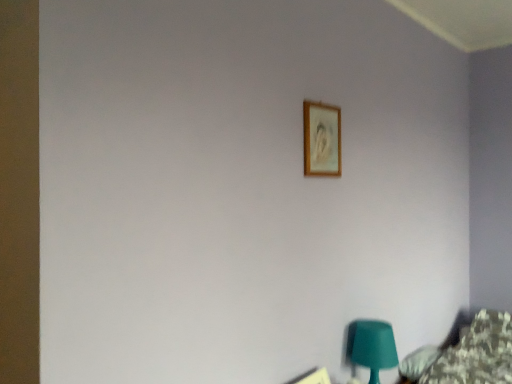
Question: Which direction should I rotate to look at wooden picture frame at upper center, which is the 1th picture frame in bottom-to-top order?

Choices:
 (A) left
 (B) right

Answer: (B)

Question: From a real-world perspective, is wooden picture frame at upper center, which is the 1th picture frame in bottom-to-top order, physically above wooden frame at upper center, the 1th picture frame positioned from the top?

Choices:
 (A) no
 (B) yes

Answer: (A)

Question: Does wooden picture frame at upper center, arranged as the 2th picture frame when viewed from the top, have a lesser height compared to wooden frame at upper center, the second picture frame in the bottom-to-top sequence?

Choices:
 (A) yes
 (B) no

Answer: (A)

Question: Can you confirm if wooden picture frame at upper center, which is the 1th picture frame in bottom-to-top order, is smaller than wooden frame at upper center, the second picture frame in the bottom-to-top sequence?

Choices:
 (A) no
 (B) yes

Answer: (A)

Question: Considering the relative sizes of wooden picture frame at upper center, which is the 1th picture frame in bottom-to-top order, and wooden frame at upper center, the second picture frame in the bottom-to-top sequence, in the image provided, is wooden picture frame at upper center, which is the 1th picture frame in bottom-to-top order, wider than wooden frame at upper center, the second picture frame in the bottom-to-top sequence,?

Choices:
 (A) yes
 (B) no

Answer: (A)

Question: From the image's perspective, is wooden picture frame at upper center, arranged as the 2th picture frame when viewed from the top, over wooden frame at upper center, the second picture frame in the bottom-to-top sequence?

Choices:
 (A) yes
 (B) no

Answer: (B)

Question: Considering the relative sizes of wooden picture frame at upper center, which is the 1th picture frame in bottom-to-top order, and wooden frame at upper center, the second picture frame in the bottom-to-top sequence, in the image provided, is wooden picture frame at upper center, which is the 1th picture frame in bottom-to-top order, thinner than wooden frame at upper center, the second picture frame in the bottom-to-top sequence,?

Choices:
 (A) yes
 (B) no

Answer: (B)

Question: Is matte green plastic table lamp at lower right aimed at wooden frame at upper center, the 1th picture frame positioned from the top?

Choices:
 (A) yes
 (B) no

Answer: (B)

Question: Does matte green plastic table lamp at lower right appear on the left side of wooden frame at upper center, the 1th picture frame positioned from the top?

Choices:
 (A) yes
 (B) no

Answer: (B)

Question: From a real-world perspective, does matte green plastic table lamp at lower right sit lower than wooden frame at upper center, the second picture frame in the bottom-to-top sequence?

Choices:
 (A) yes
 (B) no

Answer: (A)

Question: Is the position of matte green plastic table lamp at lower right more distant than that of wooden frame at upper center, the second picture frame in the bottom-to-top sequence?

Choices:
 (A) no
 (B) yes

Answer: (B)

Question: Can you confirm if matte green plastic table lamp at lower right is smaller than wooden frame at upper center, the 1th picture frame positioned from the top?

Choices:
 (A) no
 (B) yes

Answer: (A)

Question: Is matte green plastic table lamp at lower right located outside wooden frame at upper center, the 1th picture frame positioned from the top?

Choices:
 (A) no
 (B) yes

Answer: (B)

Question: Is wooden picture frame at upper center, which is the 1th picture frame in bottom-to-top order, closer to the viewer compared to matte green plastic table lamp at lower right?

Choices:
 (A) no
 (B) yes

Answer: (B)